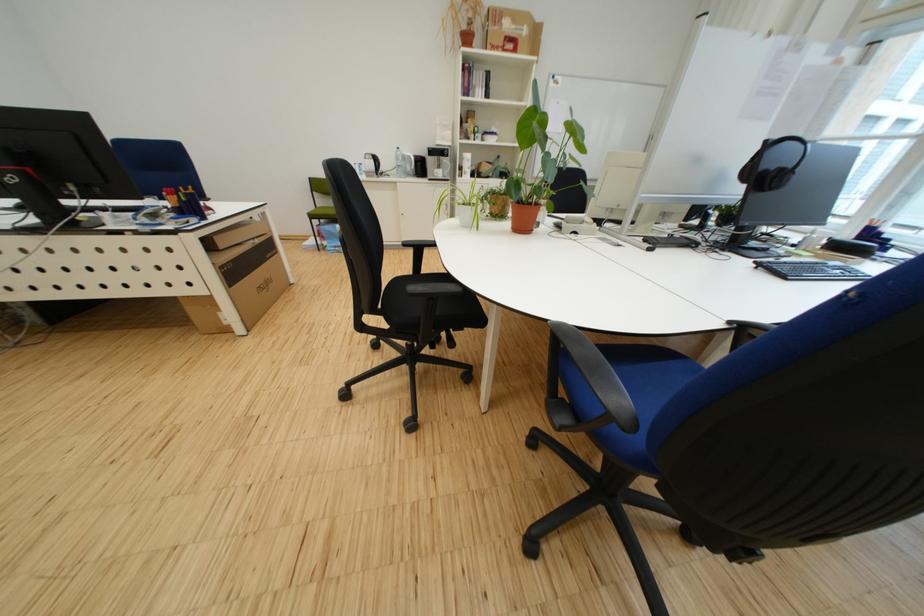
Identify the location of blue chair armrest. (419, 243).